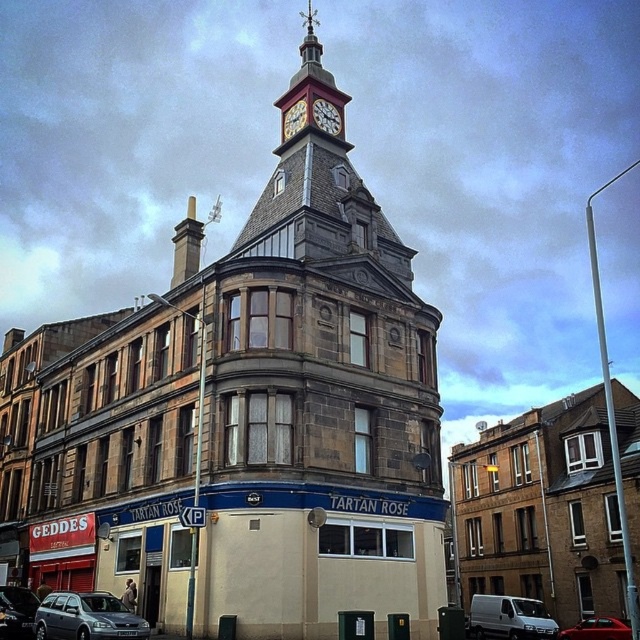
Question: Which object is closer to the camera taking this photo?

Choices:
 (A) shiny red car at center
 (B) white matte van at center
 (C) wooden clock face at upper center

Answer: (A)

Question: Which point is farther to the camera?

Choices:
 (A) white clock face at upper center
 (B) white matte van at center

Answer: (A)

Question: Is shiny red car at center positioned before wooden clock face at upper center?

Choices:
 (A) yes
 (B) no

Answer: (A)

Question: Does stone clock tower at center have a lesser width compared to shiny red car at center?

Choices:
 (A) no
 (B) yes

Answer: (A)

Question: Can you confirm if stone clock tower at center is smaller than metallic gray station wagon at lower left?

Choices:
 (A) yes
 (B) no

Answer: (B)

Question: Which point is closer to the camera?

Choices:
 (A) click(596, 621)
 (B) click(26, 632)

Answer: (B)